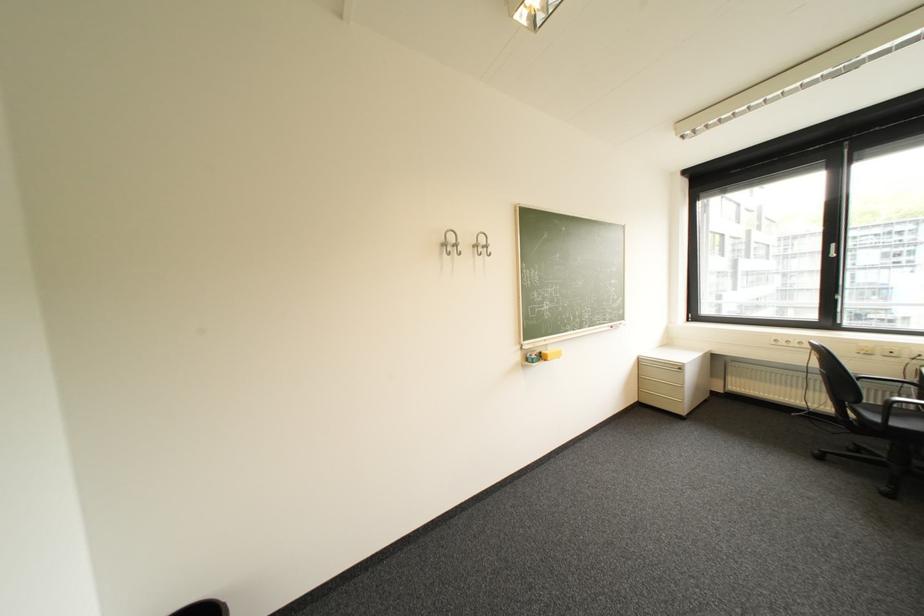
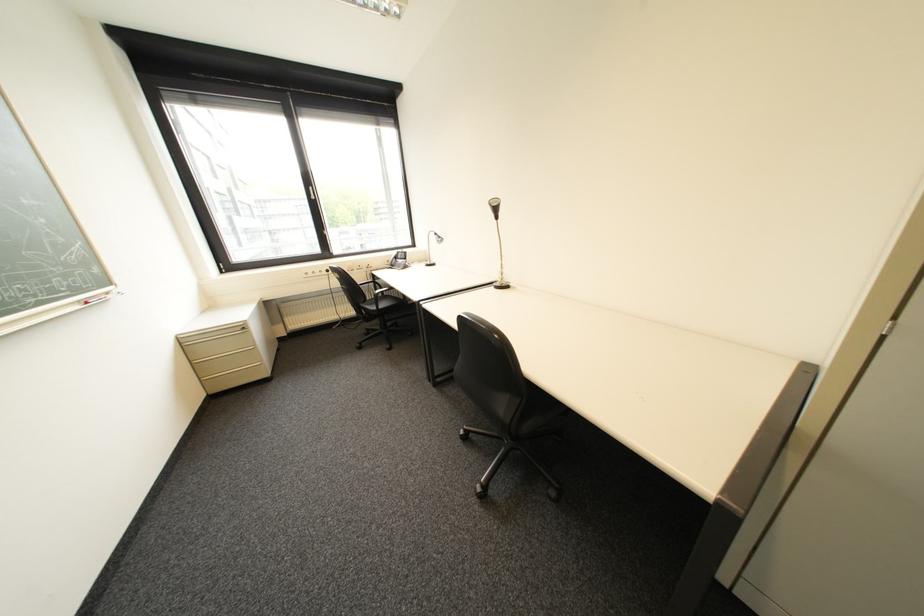
The images are taken continuously from a first-person perspective. In which direction is your viewpoint rotating?

The camera rotated toward right-down.